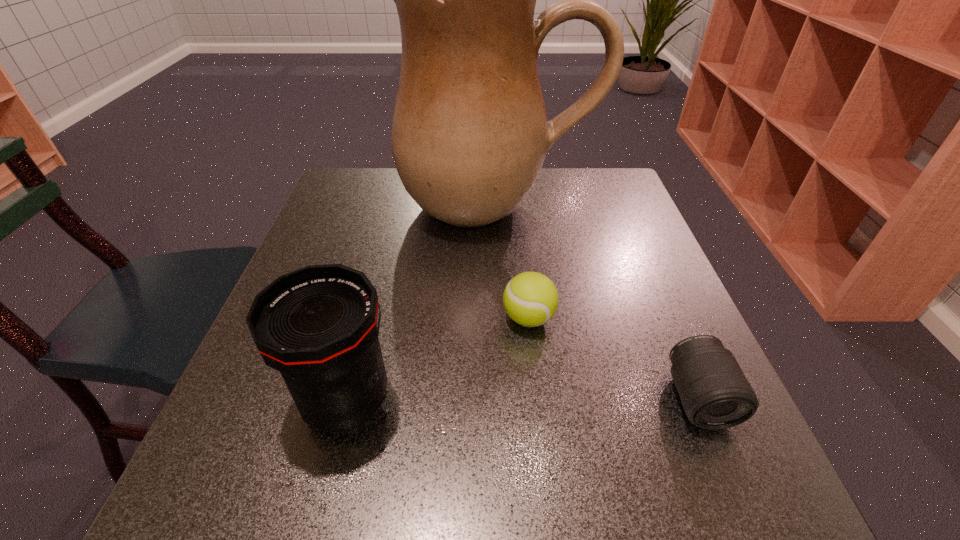
The height and width of the screenshot is (540, 960). I want to click on cream pitcher, so click(470, 134).

I want to click on the farthest object, so click(x=470, y=134).

You are a GUI agent. You are given a task and a screenshot of the screen. Output one action in this format:
    pyautogui.click(x=<x>, y=<y>)
    Task: Click on the taller telephoto lens
    The height and width of the screenshot is (540, 960).
    Given the screenshot: What is the action you would take?
    pos(318,326)

I want to click on the left telephoto lens, so click(318, 326).

Identify the location of tennis ball. (530, 299).

Find the location of a particular element. The height and width of the screenshot is (540, 960). the shorter telephoto lens is located at coordinates (715, 394).

You are a GUI agent. You are given a task and a screenshot of the screen. Output one action in this format:
    pyautogui.click(x=<x>, y=<y>)
    Task: Click on the rightmost object
    The height and width of the screenshot is (540, 960).
    Given the screenshot: What is the action you would take?
    pyautogui.click(x=715, y=394)

This screenshot has height=540, width=960. In order to click on vacant space located 0.170m at the spout of the tallest object in this screenshot , I will do `click(501, 299)`.

Locate an element on the screen. This screenshot has height=540, width=960. vacant position located 0.130m on the back of the taller telephoto lens is located at coordinates (370, 309).

Identify the location of vacant region located on the back of the third nearest object. (519, 239).